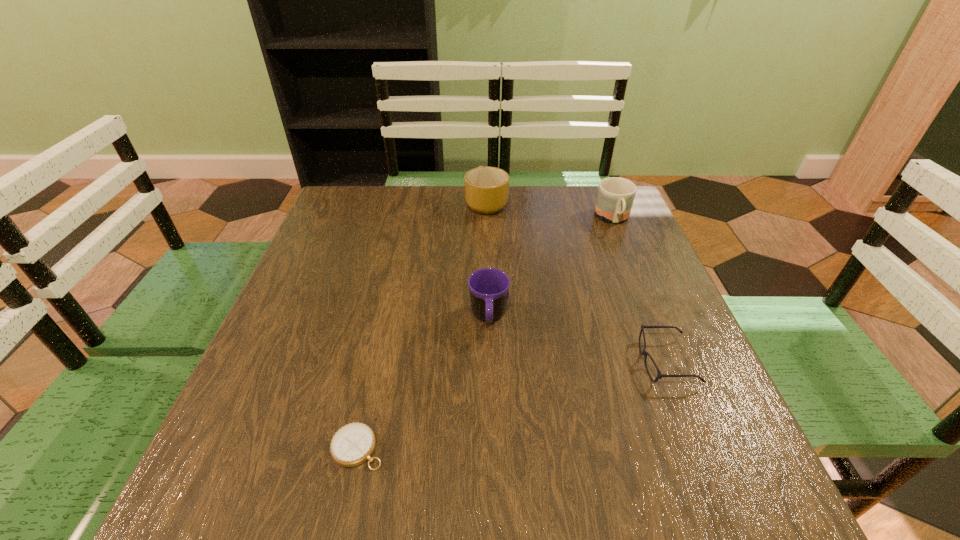
The image size is (960, 540). What are the coordinates of `mug identified as the second closest to the nearest mug` in the screenshot? It's located at (615, 197).

The width and height of the screenshot is (960, 540). Identify the location of vacant position in the image that satisfies the following two spatial constraints: 1. on the side with the handle of the rightmost mug; 2. on the front-facing side of the second shortest object. (671, 362).